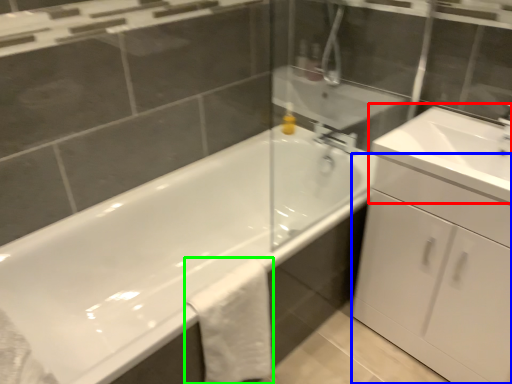
Question: Which is farther away from sink (highlighted by a red box)? cabinetry (highlighted by a blue box) or bath towel (highlighted by a green box)?

Choices:
 (A) cabinetry
 (B) bath towel

Answer: (B)